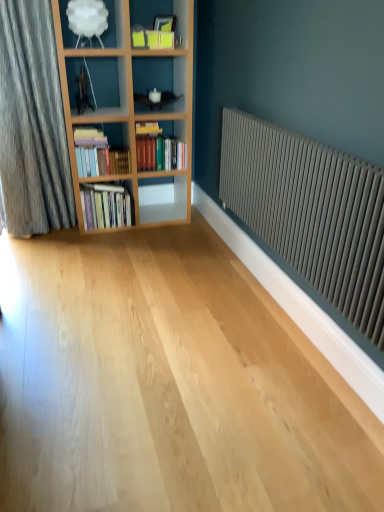
Question: Is matte gray radiator at right in front of or behind hardcover books at center, the first book positioned from the top, in the image?

Choices:
 (A) front
 (B) behind

Answer: (A)

Question: Is point (329, 198) positioned closer to the camera than point (158, 140)?

Choices:
 (A) farther
 (B) closer

Answer: (B)

Question: Which of these objects is positioned closest to the hardcover books at left, which is the 3th book in top-to-bottom order?

Choices:
 (A) white glossy shelf at center, which ranks as the first shelf in right-to-left order
 (B) white matte lampshade at upper left, placed as the 2th shelf when sorted from back to front
 (C) hardcover books at left, placed as the second book when sorted from top to bottom
 (D) matte gray radiator at right
 (E) hardcover books at center, the first book positioned from the top

Answer: (C)

Question: Which object is positioned closest to the matte gray radiator at right?

Choices:
 (A) hardcover books at center, the first book positioned from the top
 (B) white glossy shelf at center, marked as the second shelf in a left-to-right arrangement
 (C) hardcover books at left, placed as the second book when sorted from top to bottom
 (D) hardcover books at left, marked as the 1th book in a bottom-to-top arrangement
 (E) white matte lampshade at upper left, the 2th shelf viewed from the right

Answer: (A)